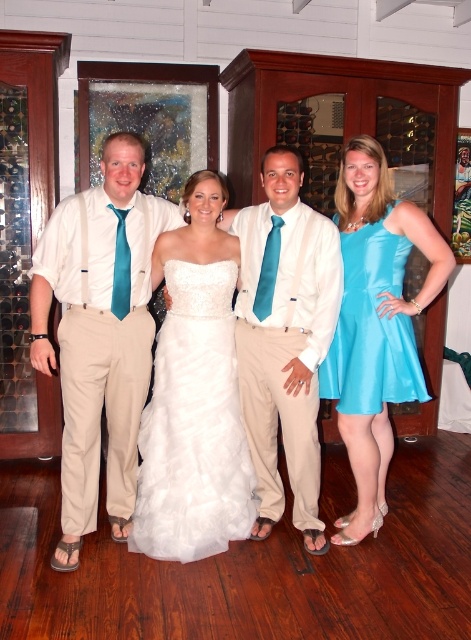
In the scene shown: You are a photographer adjusting your camera settings to focus on the white strapless gown at center. The camera can only focus on objects within a 0.1 radius of the point you select. You decide to aim for the point at coordinates (x=194, y=426). Will the camera successfully focus on the white strapless gown at center?

The white satin dress at center is located exactly at the point (x=194, y=426). Since the camera requires a 0.1 radius around the selected point for focus, and the dress is precisely at the chosen coordinates, the camera will successfully focus on the white strapless gown at center.

You are a photographer adjusting the lighting for a group photo. You notice the matte white shirt at center and the teal satin tie at center. Which item is positioned lower on the person?

The matte white shirt at center is located below the teal satin tie at center, so the matte white shirt at center is positioned lower.